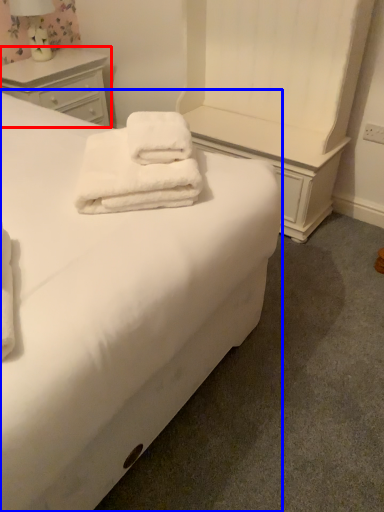
Question: Which object is closer to the camera taking this photo, chest of drawers (highlighted by a red box) or bed (highlighted by a blue box)?

Choices:
 (A) chest of drawers
 (B) bed

Answer: (B)